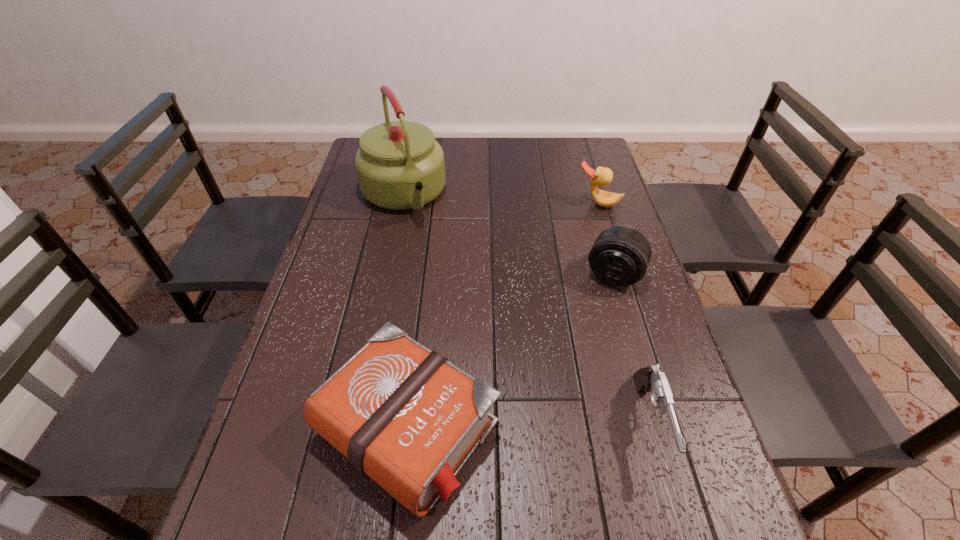
Find the location of a particular element. gun at the right edge is located at coordinates (650, 379).

This screenshot has height=540, width=960. I want to click on telephoto lens positioned at the right edge, so click(620, 256).

At what (x,y) coordinates should I click in order to perform the action: click on duck that is positioned at the right edge. Please return your answer as a coordinate pair (x, y). The height and width of the screenshot is (540, 960). Looking at the image, I should click on (602, 176).

Identify the location of object at the far left corner. (400, 166).

The height and width of the screenshot is (540, 960). I want to click on object at the near left corner, so click(x=405, y=416).

This screenshot has height=540, width=960. I want to click on object positioned at the near right corner, so click(650, 379).

Where is `free space at the left edge`? free space at the left edge is located at coordinates (348, 192).

I want to click on vacant space at the right edge, so click(x=649, y=410).

In the image, there is a desktop. Where is `vacant space at the near left corner`? The image size is (960, 540). vacant space at the near left corner is located at coordinates (308, 474).

This screenshot has width=960, height=540. In the image, there is a desktop. Find the location of `free space at the far right corner`. free space at the far right corner is located at coordinates (568, 155).